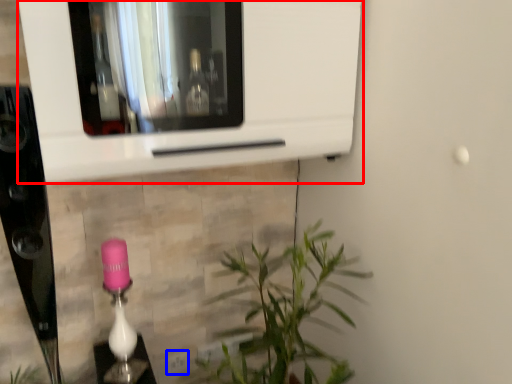
Question: Which point is further to the camera, microwave (highlighted by a red box) or electric outlet (highlighted by a blue box)?

Choices:
 (A) microwave
 (B) electric outlet

Answer: (B)